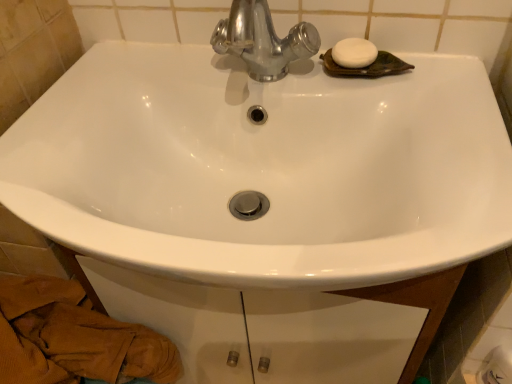
You are a GUI agent. You are given a task and a screenshot of the screen. Output one action in this format:
    pyautogui.click(x=<x>, y=<y>)
    Task: Click on the vacant space positioned to the left of white matte soap at upper right
    This screenshot has height=384, width=512.
    Given the screenshot: What is the action you would take?
    pyautogui.click(x=259, y=71)